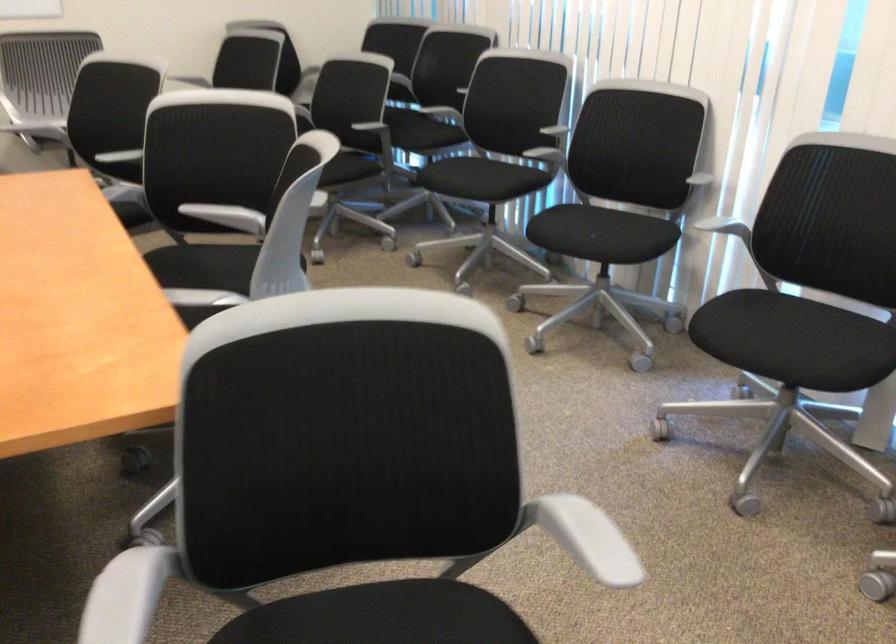
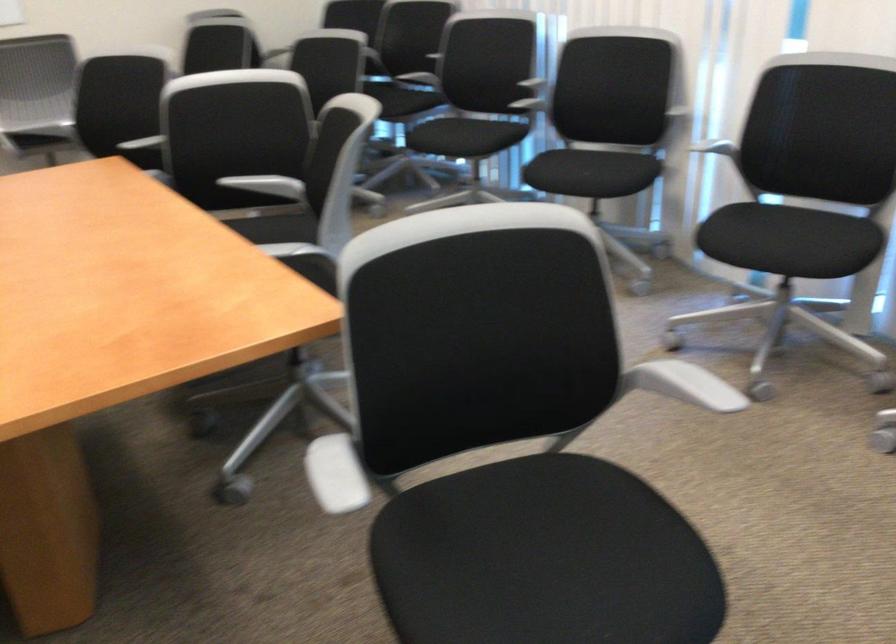
The point at (595,236) is marked in the first image. Where is the corresponding point in the second image?

(587, 174)